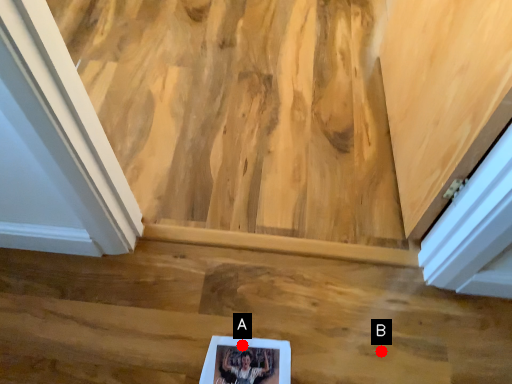
Question: Two points are circled on the image, labeled by A and B beside each circle. Which point is closer to the camera?

Choices:
 (A) A is closer
 (B) B is closer

Answer: (A)